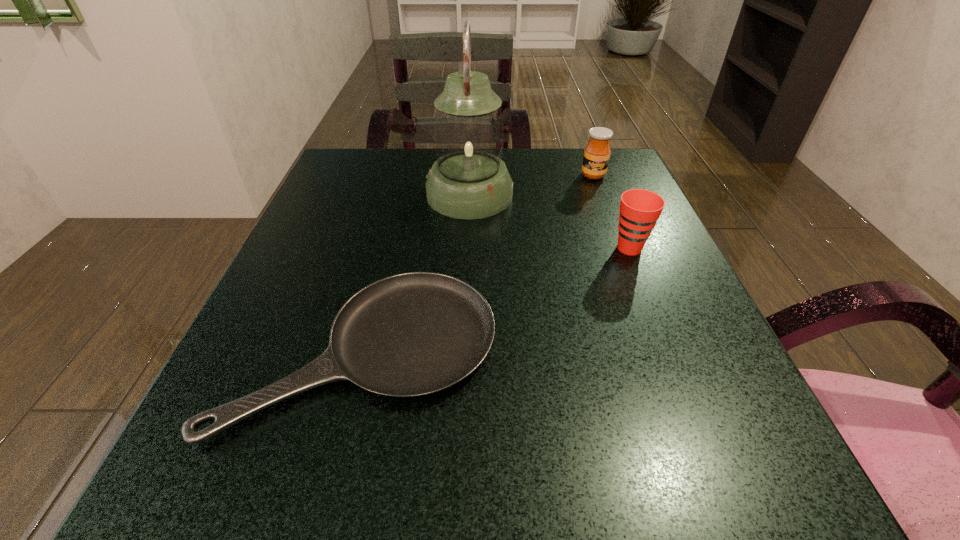
Find the location of a particular element. This screenshot has height=540, width=960. lantern is located at coordinates (469, 180).

The height and width of the screenshot is (540, 960). Find the location of `honey`. honey is located at coordinates (597, 152).

At what (x,y) coordinates should I click in order to perform the action: click on cup. Please return your answer as a coordinate pair (x, y). This screenshot has height=540, width=960. Looking at the image, I should click on (640, 209).

Identify the location of the shortest object. The width and height of the screenshot is (960, 540). (412, 334).

Locate an element on the screen. The width and height of the screenshot is (960, 540). frying pan is located at coordinates (412, 334).

Locate an element on the screen. The height and width of the screenshot is (540, 960). vacant area located 0.210m on the right of the lantern is located at coordinates (608, 195).

At what (x,y) coordinates should I click in order to perform the action: click on vacant space located on the front-facing side of the honey. Please return your answer as a coordinate pair (x, y). Image resolution: width=960 pixels, height=540 pixels. Looking at the image, I should click on (619, 243).

This screenshot has height=540, width=960. In order to click on vacant region located 0.050m on the front of the cup in this screenshot , I will do `click(642, 279)`.

Where is `free location located on the back of the shortest object`? This screenshot has width=960, height=540. free location located on the back of the shortest object is located at coordinates (405, 182).

Locate an element on the screen. The height and width of the screenshot is (540, 960). lantern that is positioned at the far edge is located at coordinates (469, 180).